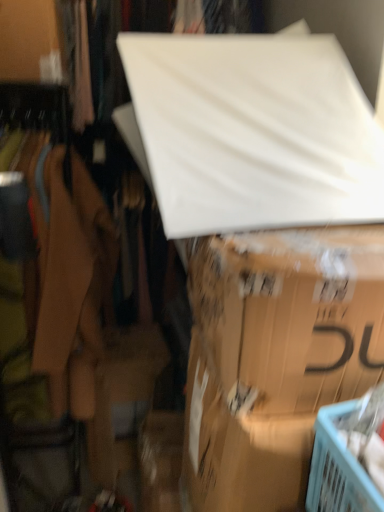
Where is `matte cardboard box at center`? Image resolution: width=384 pixels, height=512 pixels. matte cardboard box at center is located at coordinates (275, 356).

Describe the element at coordinates (275, 356) in the screenshot. I see `matte cardboard box at center` at that location.

I want to click on white matte board at upper center, so click(x=23, y=32).

In terms of size, does white matte board at upper center appear bigger or smaller than white matte board at upper center?

In the image, white matte board at upper center appears to be smaller than white matte board at upper center.

Which of these two, white matte board at upper center or white matte board at upper center, is wider?

With larger width is white matte board at upper center.

Is white matte board at upper center next to white matte board at upper center?

No, white matte board at upper center is not in contact with white matte board at upper center.

Based on their sizes in the image, would you say white matte board at upper center is bigger or smaller than white matte board at upper center?

Considering their sizes, white matte board at upper center takes up more space than white matte board at upper center.

How many degrees apart are the facing directions of white matte board at upper center and white matte board at upper center?

white matte board at upper center and white matte board at upper center are facing 4.39 degrees away from each other.

Does point (32, 56) appear closer or farther from the camera than point (170, 207)?

Clearly, point (32, 56) is more distant from the camera than point (170, 207).

From a real-world perspective, is white matte board at upper center positioned over white matte board at upper center based on gravity?

No, from a real-world perspective, white matte board at upper center is not on top of white matte board at upper center.

Is matte cardboard box at center placed right next to white matte board at upper center?

No, matte cardboard box at center is not making contact with white matte board at upper center.

Where is `linen behind the matte cardboard box at center`? linen behind the matte cardboard box at center is located at coordinates (253, 132).

Considering the relative positions of matte cardboard box at center and white matte board at upper center in the image provided, is matte cardboard box at center in front of white matte board at upper center?

Yes, it is.

Is matte cardboard box at center bigger or smaller than white matte board at upper center?

Clearly, matte cardboard box at center is smaller in size than white matte board at upper center.

Which object is wider, white matte board at upper center or matte cardboard box at center?

With larger width is matte cardboard box at center.

Based on the photo, from the image's perspective, which is above, white matte board at upper center or matte cardboard box at center?

From the image's view, white matte board at upper center is above.

From a real-world perspective, which object rests below the other?

white matte board at upper center.

Consider the image. Is the depth of white matte board at upper center less than that of matte cardboard box at center?

No, white matte board at upper center is behind matte cardboard box at center.

Which is nearer, (244, 196) or (363, 340)?

The point (363, 340) is closer to the camera.

What's the angular difference between white matte board at upper center and matte cardboard box at center's facing directions?

There is a 98.4-degree angle between the facing directions of white matte board at upper center and matte cardboard box at center.

Find the location of a particular element. box in front of the white matte board at upper center is located at coordinates (275, 356).

From a real-world perspective, is white matte board at upper center positioned above or below matte cardboard box at center?

white matte board at upper center is situated higher than matte cardboard box at center in the real world.

This screenshot has height=512, width=384. What are the coordinates of `box that is above the white matte board at upper center (from a real-world perspective)` in the screenshot? It's located at (275, 356).

Based on the photo, is matte cardboard box at center further to camera compared to white matte board at upper center?

No.

From their relative heights in the image, would you say matte cardboard box at center is taller or shorter than white matte board at upper center?

In the image, matte cardboard box at center appears to be shorter than white matte board at upper center.

Is matte cardboard box at center to the left or to the right of white matte board at upper center in the image?

matte cardboard box at center is positioned on white matte board at upper center's right side.

The image size is (384, 512). Find the location of `closet located underneath the white matte board at upper center (from a real-world perspective)`. closet located underneath the white matte board at upper center (from a real-world perspective) is located at coordinates (23, 32).

The width and height of the screenshot is (384, 512). I want to click on linen that appears above the white matte board at upper center (from a real-world perspective), so click(x=253, y=132).

Estimate the real-world distances between objects in this image. Which object is closer to white matte board at upper center, white matte board at upper center or matte cardboard box at center?

white matte board at upper center.

From the image, which object appears to be nearer to matte cardboard box at center, white matte board at upper center or white matte board at upper center?

Among the two, white matte board at upper center is located nearer to matte cardboard box at center.

Considering their positions, is matte cardboard box at center positioned further to white matte board at upper center than white matte board at upper center?

Among the two, matte cardboard box at center is located further to white matte board at upper center.

Estimate the real-world distances between objects in this image. Which object is further from white matte board at upper center, white matte board at upper center or matte cardboard box at center?

white matte board at upper center is positioned further to the anchor white matte board at upper center.

Based on the photo, considering their positions, is matte cardboard box at center positioned further to white matte board at upper center than white matte board at upper center?

white matte board at upper center lies further to white matte board at upper center than the other object.

Which object lies nearer to the anchor point matte cardboard box at center, white matte board at upper center or white matte board at upper center?

The object closer to matte cardboard box at center is white matte board at upper center.

Locate an element on the screen. Image resolution: width=384 pixels, height=512 pixels. linen between white matte board at upper center and matte cardboard box at center from left to right is located at coordinates (253, 132).